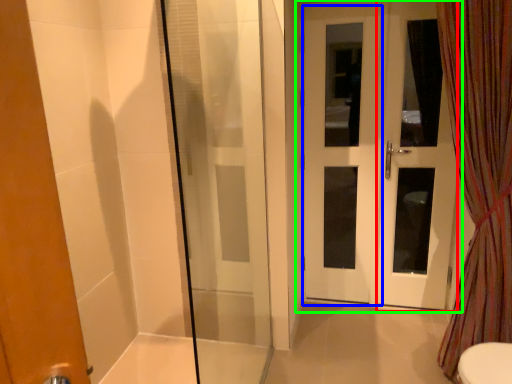
Question: Considering the real-world distances, which object is closest to screen door (highlighted by a red box)? screen door (highlighted by a blue box) or door (highlighted by a green box).

Choices:
 (A) screen door
 (B) door

Answer: (B)